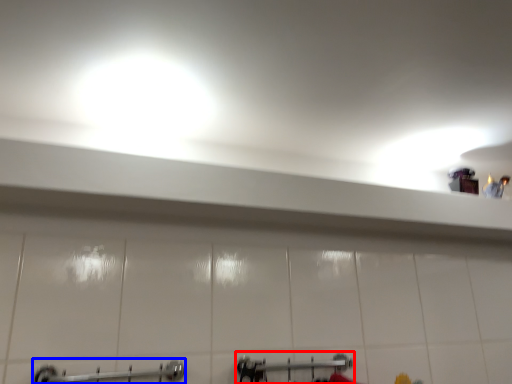
Question: Which object appears closest to the camera in this image, shower (highlighted by a red box) or towel rack (highlighted by a blue box)?

Choices:
 (A) shower
 (B) towel rack

Answer: (B)